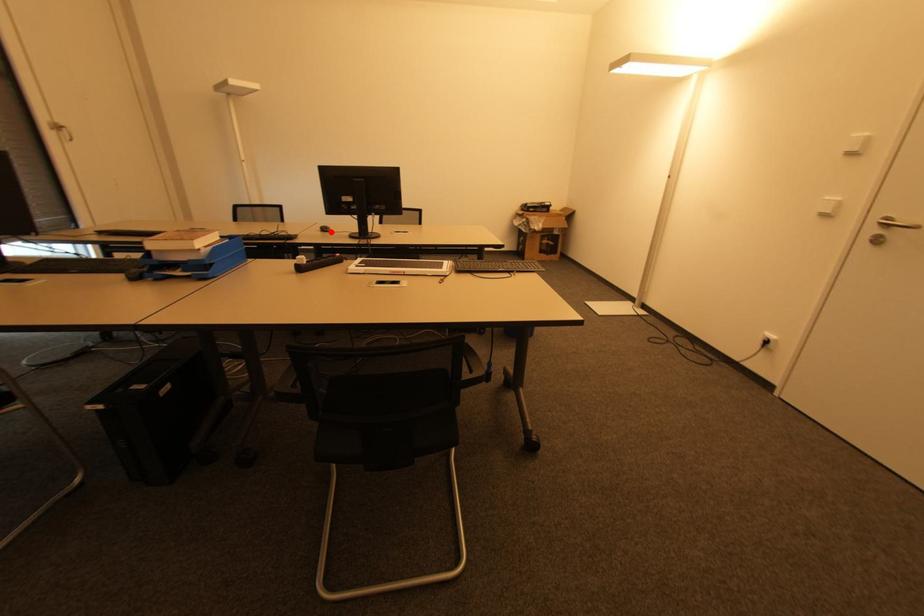
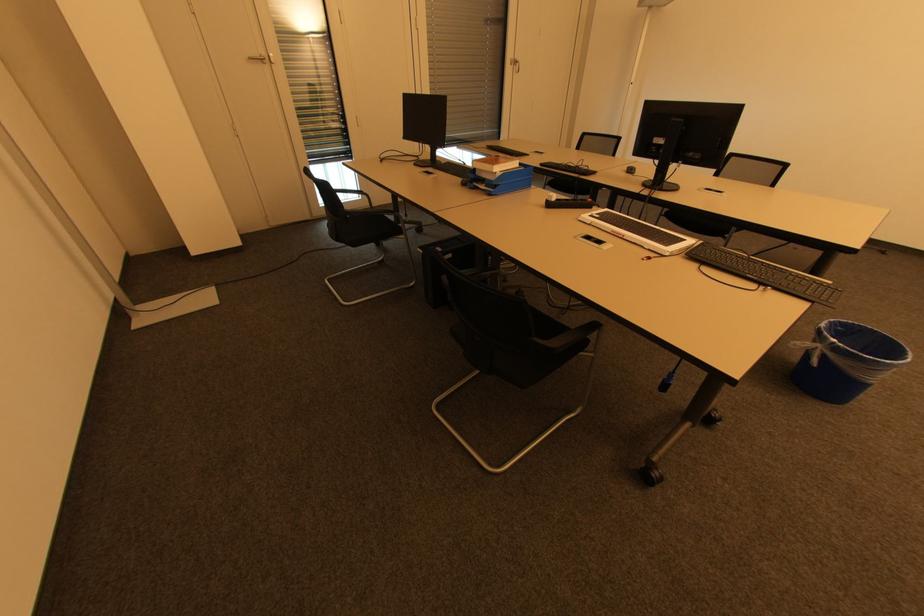
Locate, in the second image, the point that corresponds to the highlighted location in the first image.

(634, 174)